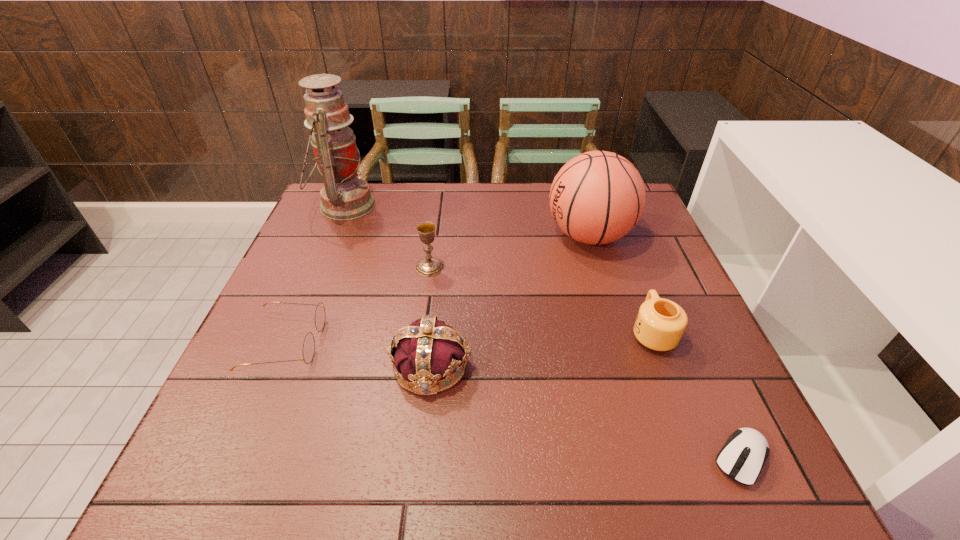
Locate an element on the screen. oil lamp is located at coordinates (344, 196).

Locate an element on the screen. the sixth shortest object is located at coordinates (597, 197).

Locate an element on the screen. chalice is located at coordinates (429, 266).

In order to click on crown in this screenshot , I will do `click(429, 350)`.

Identify the location of mug. The height and width of the screenshot is (540, 960). (660, 323).

You are a GUI agent. You are given a task and a screenshot of the screen. Output one action in this format:
    pyautogui.click(x=<x>, y=<y>)
    Task: Click on the second shortest object
    The image size is (960, 540).
    Given the screenshot: What is the action you would take?
    pyautogui.click(x=309, y=342)

I want to click on mouse, so click(x=742, y=457).

At what (x,y) coordinates should I click in order to perform the action: click on the shortest object. Please return your answer as a coordinate pair (x, y). The width and height of the screenshot is (960, 540). Looking at the image, I should click on (742, 457).

The width and height of the screenshot is (960, 540). I want to click on free space located 0.150m on the right of the oil lamp, so click(424, 205).

You are a GUI agent. You are given a task and a screenshot of the screen. Output one action in this format:
    pyautogui.click(x=<x>, y=<y>)
    Task: Click on the free space located 0.310m on the surface of the basketball near the brand logo
    
    Given the screenshot: What is the action you would take?
    pyautogui.click(x=434, y=235)